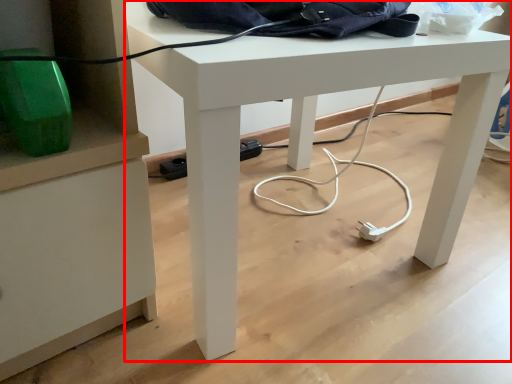
Question: From the image's perspective, where is desk (annotated by the red box) located in relation to messenger bag in the image?

Choices:
 (A) above
 (B) below

Answer: (B)